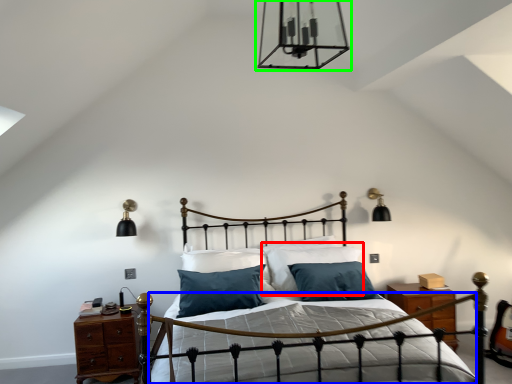
Question: Considering the real-world distances, which object is closest to pillow (highlighted by a red box)? bed frame (highlighted by a blue box) or light fixture (highlighted by a green box).

Choices:
 (A) bed frame
 (B) light fixture

Answer: (A)